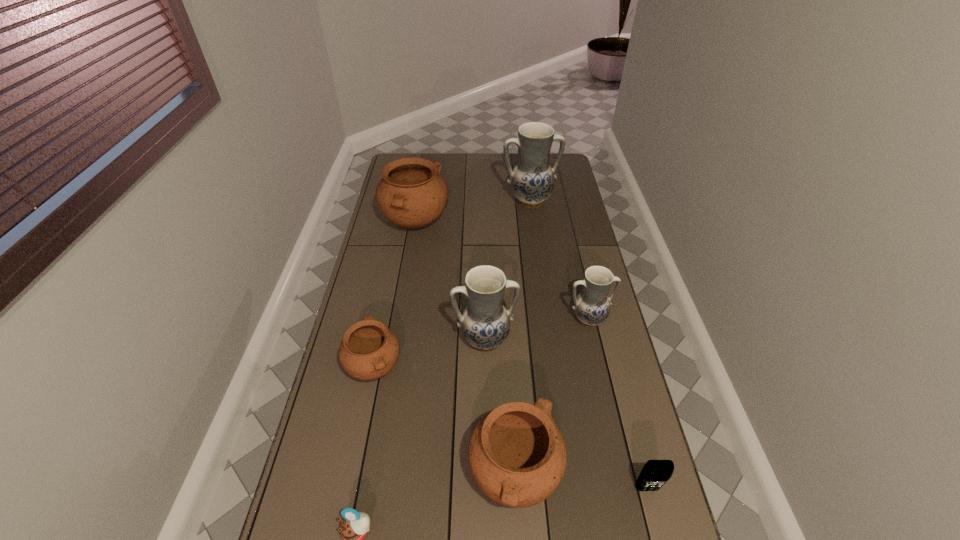
Locate which blue pottery is the closest to the cellular telephone. Please provide its 2D coordinates. Your answer should be formatted as a tuple, i.e. [(x, y)], where the tuple contains the x and y coordinates of a point satisfying the conditions above.

[(485, 323)]

Locate which blue pottery is the second closest to the biggest terracotta pottery. Please provide its 2D coordinates. Your answer should be formatted as a tuple, i.e. [(x, y)], where the tuple contains the x and y coordinates of a point satisfying the conditions above.

[(485, 323)]

Where is `terracotta pottery that is the second closest to the smallest blue pottery`? terracotta pottery that is the second closest to the smallest blue pottery is located at coordinates (412, 194).

Where is `terracotta pottery that stands as the second closest to the smallest blue pottery`? The image size is (960, 540). terracotta pottery that stands as the second closest to the smallest blue pottery is located at coordinates (412, 194).

You are a GUI agent. You are given a task and a screenshot of the screen. Output one action in this format:
    pyautogui.click(x=<x>, y=<y>)
    Task: Click on the free location that satisfies the following two spatial constraints: 1. on the front side of the smallest blue pottery; 2. on the right side of the farthest terracotta pottery
    This screenshot has width=960, height=540.
    Given the screenshot: What is the action you would take?
    pyautogui.click(x=398, y=319)